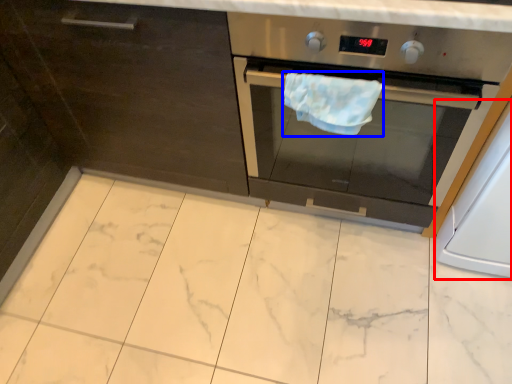
Question: Among these objects, which one is farthest to the camera, appliance (highlighted by a red box) or hand towel (highlighted by a blue box)?

Choices:
 (A) appliance
 (B) hand towel

Answer: (B)